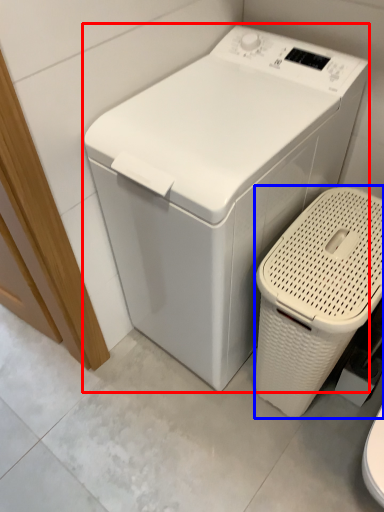
Question: Which of the following is the farthest to the observer, washing machine (highlighted by a red box) or garbage (highlighted by a blue box)?

Choices:
 (A) washing machine
 (B) garbage

Answer: (B)